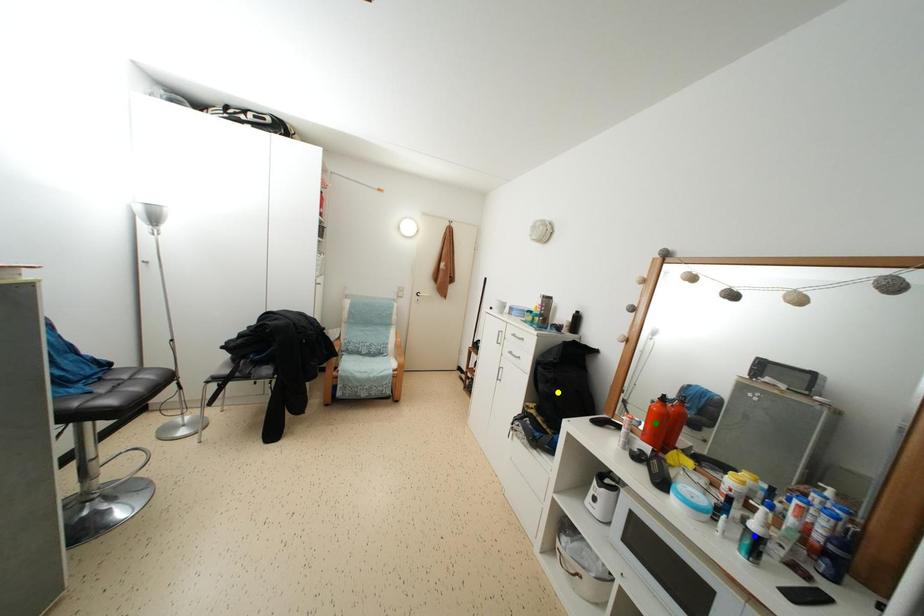
Order these from farthest to nearest:
blue point | yellow point | green point

green point
yellow point
blue point